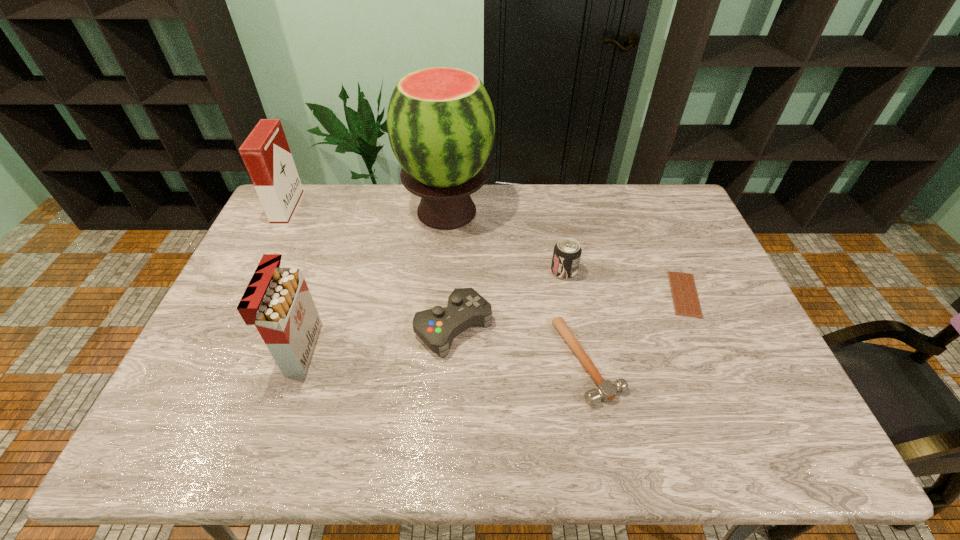
Where is `the tallest object`? the tallest object is located at coordinates (441, 126).

At what (x,y) coordinates should I click in order to perform the action: click on the left cigarette case. Please return your answer as a coordinate pair (x, y). This screenshot has width=960, height=540. Looking at the image, I should click on (266, 154).

Locate an element on the screen. the farther cigarette case is located at coordinates (266, 154).

You are a GUI agent. You are given a task and a screenshot of the screen. Output one action in this format:
    pyautogui.click(x=<x>, y=<y>)
    Task: Click on the right cigarette case
    Image resolution: width=960 pixels, height=540 pixels.
    Given the screenshot: What is the action you would take?
    pyautogui.click(x=277, y=301)

I want to click on the second object from left to right, so click(277, 301).

At what (x,y) coordinates should I click in order to perform the action: click on soda can. Please return your answer as a coordinate pair (x, y). The image size is (960, 540). Looking at the image, I should click on (567, 252).

The width and height of the screenshot is (960, 540). In order to click on the third shortest object in this screenshot , I will do `click(437, 327)`.

The width and height of the screenshot is (960, 540). I want to click on the sixth tallest object, so click(606, 391).

This screenshot has height=540, width=960. In order to click on the rightmost object in this screenshot , I will do `click(684, 293)`.

Locate an element on the screen. chocolate bar is located at coordinates (684, 293).